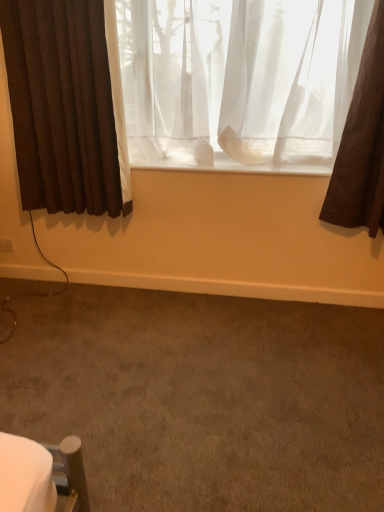
Question: In terms of size, does brown carpet at lower center appear bigger or smaller than brown fabric curtain at left, arranged as the first curtain when viewed from the left?

Choices:
 (A) big
 (B) small

Answer: (A)

Question: From a real-world perspective, is brown carpet at lower center physically located above or below brown fabric curtain at left, arranged as the first curtain when viewed from the left?

Choices:
 (A) below
 (B) above

Answer: (A)

Question: Which object is the closest to the brown carpet at lower center?

Choices:
 (A) white plastic electric outlet at lower left
 (B) sheer white curtain at center, placed as the second curtain when sorted from left to right
 (C) brown fabric curtain at left, arranged as the first curtain when viewed from the left

Answer: (C)

Question: Estimate the real-world distances between objects in this image. Which object is farther from the white plastic electric outlet at lower left?

Choices:
 (A) sheer white curtain at center, which is counted as the 1th curtain, starting from the right
 (B) brown fabric curtain at left, marked as the 2th curtain in a right-to-left arrangement
 (C) brown carpet at lower center

Answer: (A)